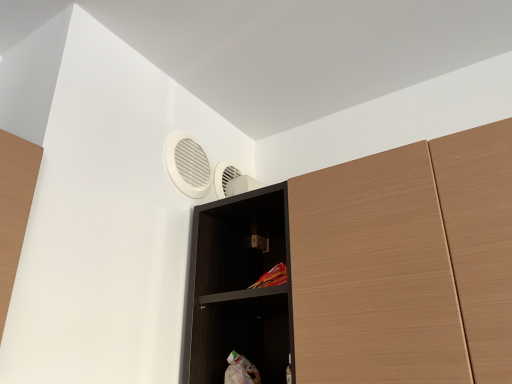
Question: Is white plastic air conditioning at upper center not close to wooden cupboard at upper right?

Choices:
 (A) no
 (B) yes

Answer: (A)

Question: Considering the relative sizes of white plastic air conditioning at upper center and wooden cupboard at upper right in the image provided, is white plastic air conditioning at upper center bigger than wooden cupboard at upper right?

Choices:
 (A) no
 (B) yes

Answer: (A)

Question: Is white plastic air conditioning at upper center outside of wooden cupboard at upper right?

Choices:
 (A) no
 (B) yes

Answer: (B)

Question: Does white plastic air conditioning at upper center turn towards wooden cupboard at upper right?

Choices:
 (A) no
 (B) yes

Answer: (A)

Question: Is white plastic air conditioning at upper center beside wooden cupboard at upper right?

Choices:
 (A) no
 (B) yes

Answer: (A)

Question: Does point (436, 359) appear closer or farther from the camera than point (252, 279)?

Choices:
 (A) closer
 (B) farther

Answer: (A)

Question: Based on their sizes in the image, would you say wooden cupboard at upper right is bigger or smaller than black wood shelf at upper center?

Choices:
 (A) big
 (B) small

Answer: (A)

Question: Considering the positions of wooden cupboard at upper right and black wood shelf at upper center in the image, is wooden cupboard at upper right wider or thinner than black wood shelf at upper center?

Choices:
 (A) thin
 (B) wide

Answer: (B)

Question: Considering their positions, is wooden cupboard at upper right located in front of or behind black wood shelf at upper center?

Choices:
 (A) front
 (B) behind

Answer: (A)

Question: Is point (226, 312) positioned closer to the camera than point (258, 215)?

Choices:
 (A) farther
 (B) closer

Answer: (B)

Question: Looking at the image, does black wood shelf at upper center seem bigger or smaller compared to wooden cupboard at upper right?

Choices:
 (A) big
 (B) small

Answer: (B)

Question: From the image's perspective, is black wood shelf at upper center located above or below wooden cupboard at upper right?

Choices:
 (A) below
 (B) above

Answer: (A)

Question: Which is correct: black wood shelf at upper center is inside wooden cupboard at upper right, or outside of it?

Choices:
 (A) outside
 (B) inside

Answer: (A)

Question: Considering the positions of wooden cupboard at upper right and white plastic air conditioning at upper center in the image, is wooden cupboard at upper right wider or thinner than white plastic air conditioning at upper center?

Choices:
 (A) thin
 (B) wide

Answer: (B)

Question: From the image's perspective, relative to white plastic air conditioning at upper center, is wooden cupboard at upper right above or below?

Choices:
 (A) below
 (B) above

Answer: (A)